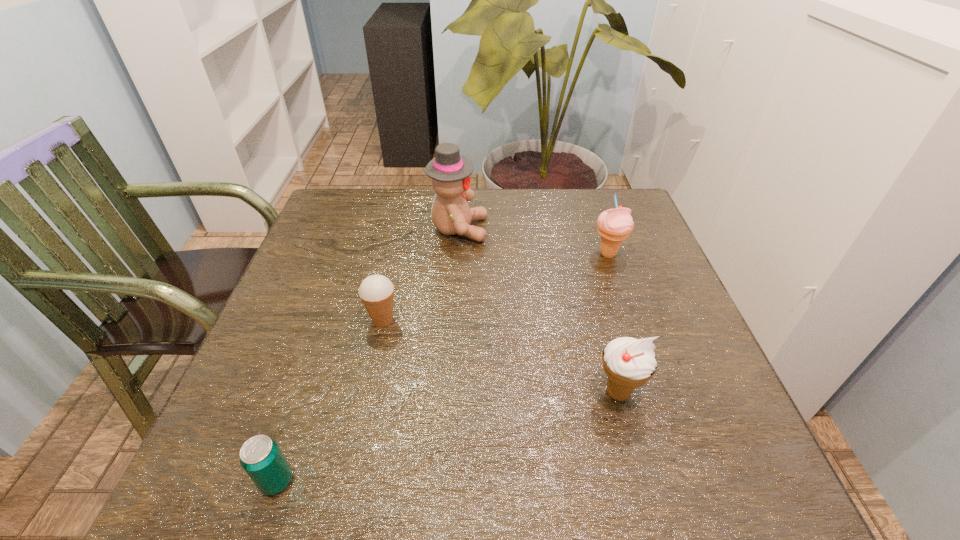
I want to click on vacant point located between the fourth farthest object and the farthest icecream, so click(612, 323).

I want to click on object that stands as the third closest to the rag_doll, so click(628, 362).

You are a GUI agent. You are given a task and a screenshot of the screen. Output one action in this format:
    pyautogui.click(x=<x>, y=<y>)
    Task: Click on the object that can be found as the second closest to the second shortest object
    
    Given the screenshot: What is the action you would take?
    pyautogui.click(x=262, y=459)

What are the coordinates of `icecream that can be found as the closest to the third nearest object` in the screenshot? It's located at (628, 362).

Locate an element on the screen. Image resolution: width=960 pixels, height=540 pixels. icecream that is the third closest to the tallest object is located at coordinates (628, 362).

Image resolution: width=960 pixels, height=540 pixels. Identify the location of vacant area that satisfies the following two spatial constraints: 1. on the back side of the farthest icecream; 2. on the left side of the beer can. (353, 254).

I want to click on blank area in the image that satisfies the following two spatial constraints: 1. on the front-facing side of the rag_doll; 2. on the right side of the farthest icecream, so [457, 254].

The image size is (960, 540). In order to click on free region that satisfies the following two spatial constraints: 1. on the front-facing side of the farthest icecream; 2. on the right side of the third object from right to left in this screenshot , I will do `click(457, 254)`.

This screenshot has width=960, height=540. Identify the location of vacant area that satisfies the following two spatial constraints: 1. on the front-facing side of the fourth farthest object; 2. on the right side of the third object from right to left. (448, 392).

Find the location of a particular element. vacant point that satisfies the following two spatial constraints: 1. on the front-facing side of the tallest object; 2. on the back side of the farthest icecream is located at coordinates (457, 254).